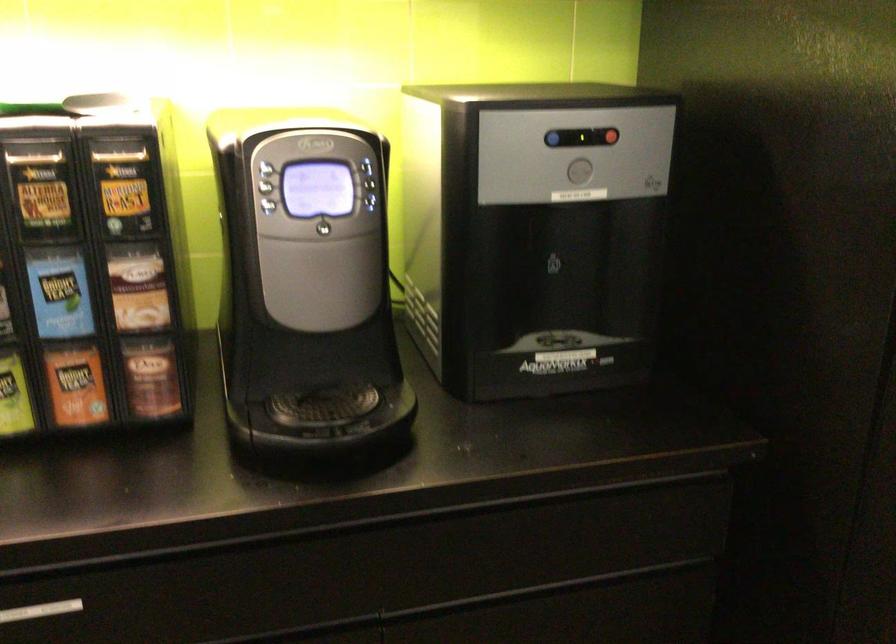
Where is `red dispenser button`? This screenshot has height=644, width=896. red dispenser button is located at coordinates (612, 136).